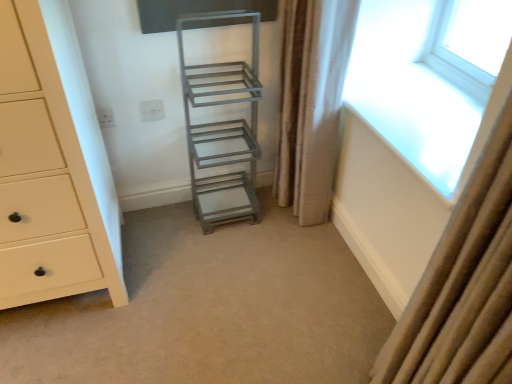
Question: From the image's perspective, would you say metallic gray ladder at center is shown under matte cream chest of drawers at left?

Choices:
 (A) yes
 (B) no

Answer: (A)

Question: From a real-world perspective, is metallic gray ladder at center located higher than matte cream chest of drawers at left?

Choices:
 (A) yes
 (B) no

Answer: (B)

Question: Is the depth of metallic gray ladder at center less than that of matte cream chest of drawers at left?

Choices:
 (A) yes
 (B) no

Answer: (B)

Question: Can you confirm if metallic gray ladder at center is taller than matte cream chest of drawers at left?

Choices:
 (A) no
 (B) yes

Answer: (A)

Question: Is metallic gray ladder at center smaller than matte cream chest of drawers at left?

Choices:
 (A) yes
 (B) no

Answer: (A)

Question: Is metallic gray ladder at center positioned beyond the bounds of matte cream chest of drawers at left?

Choices:
 (A) yes
 (B) no

Answer: (A)

Question: From the image's perspective, is metallic gray shelf at center on top of metallic gray ladder at center?

Choices:
 (A) yes
 (B) no

Answer: (A)

Question: Is metallic gray shelf at center aimed at metallic gray ladder at center?

Choices:
 (A) yes
 (B) no

Answer: (B)

Question: Does metallic gray shelf at center have a lesser width compared to metallic gray ladder at center?

Choices:
 (A) no
 (B) yes

Answer: (B)

Question: Considering the relative sizes of metallic gray shelf at center and metallic gray ladder at center in the image provided, is metallic gray shelf at center shorter than metallic gray ladder at center?

Choices:
 (A) no
 (B) yes

Answer: (A)

Question: From the image's perspective, does metallic gray shelf at center appear lower than metallic gray ladder at center?

Choices:
 (A) yes
 (B) no

Answer: (B)

Question: Can you confirm if metallic gray shelf at center is positioned to the left of metallic gray ladder at center?

Choices:
 (A) no
 (B) yes

Answer: (A)

Question: Considering the relative sizes of beige textured curtain at right, which is counted as the second curtain, starting from the right, and metallic gray ladder at center in the image provided, is beige textured curtain at right, which is counted as the second curtain, starting from the right, smaller than metallic gray ladder at center?

Choices:
 (A) no
 (B) yes

Answer: (A)